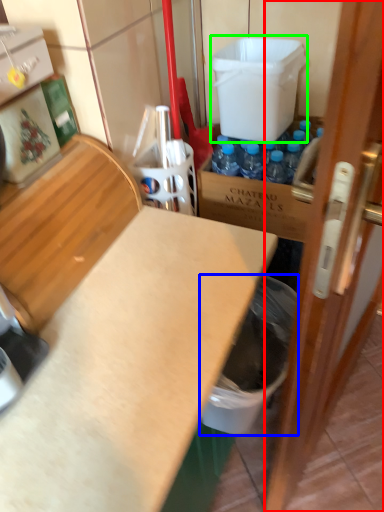
Question: Estimate the real-world distances between objects in this image. Which object is closer to door (highlighted by a red box), garbage (highlighted by a blue box) or water cooler (highlighted by a green box)?

Choices:
 (A) garbage
 (B) water cooler

Answer: (A)